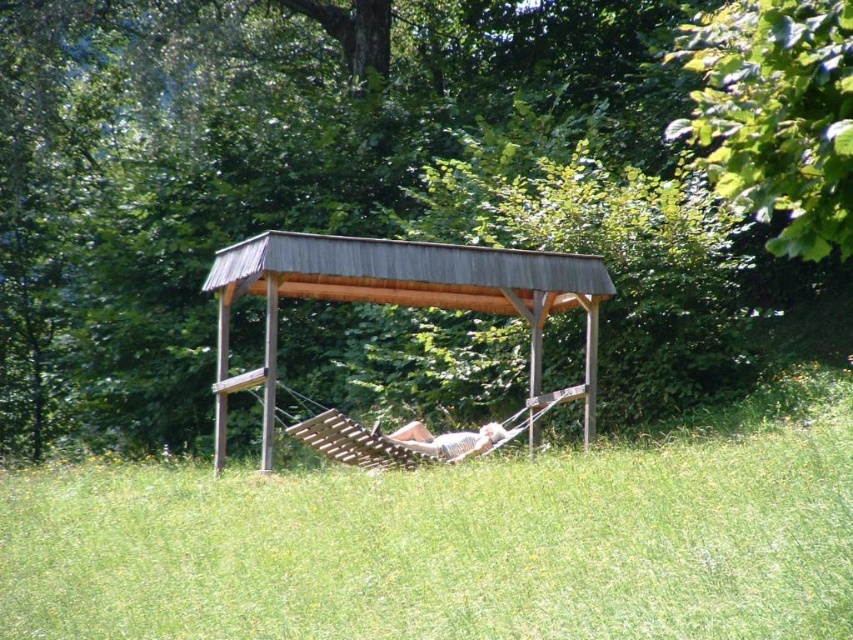
You are planning to take a photo of the light brown wooden hammock at center and the green leafy tree at upper center. Which object appears wider in the image?

The green leafy tree at upper center appears wider than the light brown wooden hammock at center.

You are standing in the serene outdoor scene and want to take a photo of the light brown wooden hammock at center. To avoid blocking the view of the green leafy tree at upper center in the background, where should you position yourself relative to the hammock?

To avoid blocking the view of the green leafy tree at upper center, you should position yourself to the right side of the light brown wooden hammock at center since the tree is on the left side of the hammock.